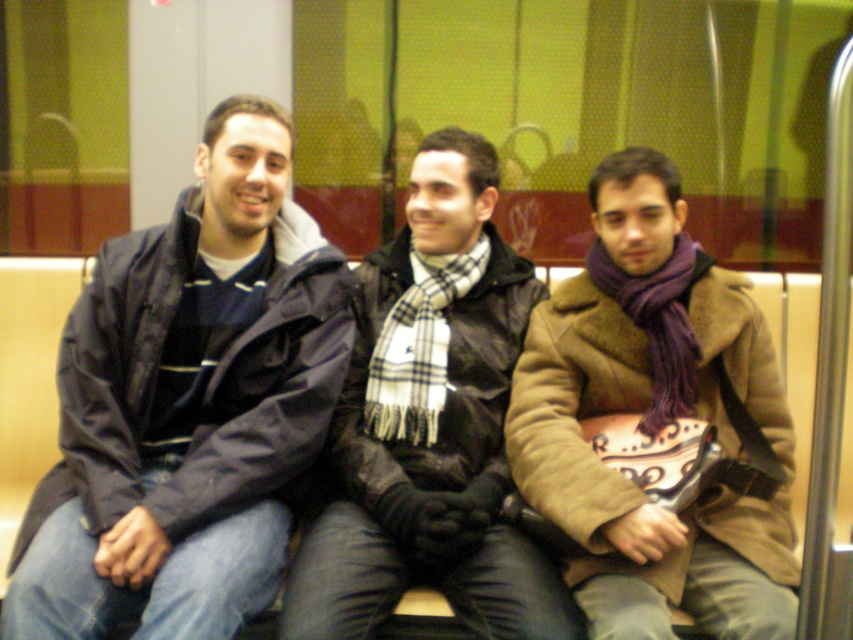
You are a photographer standing in front of the subway seat. You want to take a photo of the matte black jacket at left and the plaid scarf at center. Which one should you focus on first if you want to capture both in the same frame without moving the camera?

The matte black jacket at left is to the left of plaid scarf at center, so you should focus on the matte black jacket at left first to ensure both are in the frame without moving the camera.

Based on the coordinates provided, which object is located at point (189, 404)?

The point (189, 404) corresponds to the matte black jacket at left.

You are a photographer trying to capture a group photo of the three individuals on the subway. You want to ensure that both the purple wool scarf at center and the plaid scarf at center are clearly visible in the photo. Given their sizes, which scarf might require you to adjust your camera angle to avoid overlapping with other parts of their clothing?

The purple wool scarf at center has a larger width than the plaid scarf at center, so it might require adjusting the camera angle to avoid overlapping with other parts of their clothing.